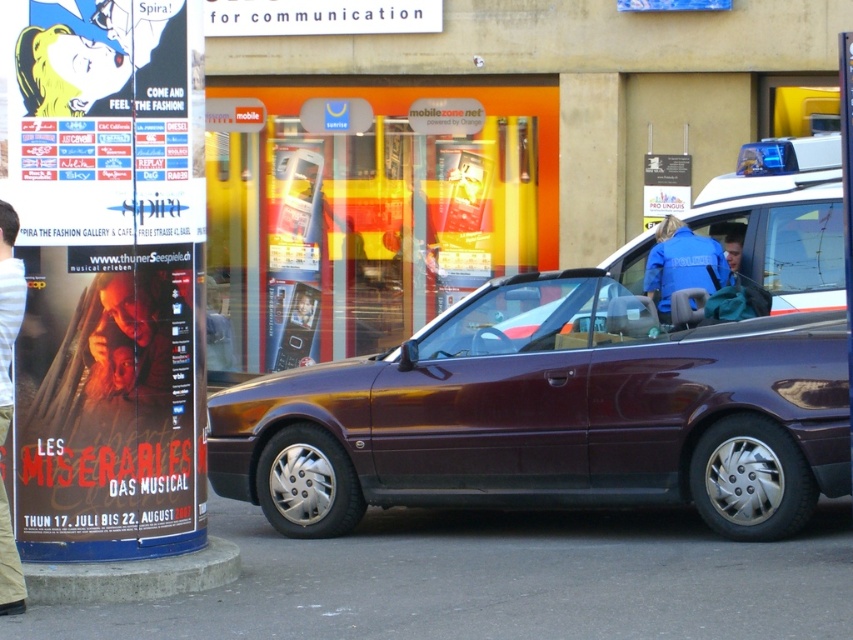
Question: Which object appears farthest from the camera in this image?

Choices:
 (A) matte paper poster at left
 (B) concrete at lower left
 (C) light beige pants at left
 (D) satin burgundy convertible at center

Answer: (D)

Question: Does light beige pants at left appear on the right side of blue fabric jacket at center?

Choices:
 (A) no
 (B) yes

Answer: (A)

Question: Does matte paper poster at left come behind concrete at lower left?

Choices:
 (A) yes
 (B) no

Answer: (A)

Question: Which point is closer to the camera?

Choices:
 (A) concrete at lower left
 (B) light beige pants at left
 (C) matte paper poster at left

Answer: (B)

Question: Which of the following is the closest to the observer?

Choices:
 (A) (132, 547)
 (B) (699, 259)
 (C) (236, 556)

Answer: (A)

Question: Is concrete at lower left bigger than light beige pants at left?

Choices:
 (A) yes
 (B) no

Answer: (A)